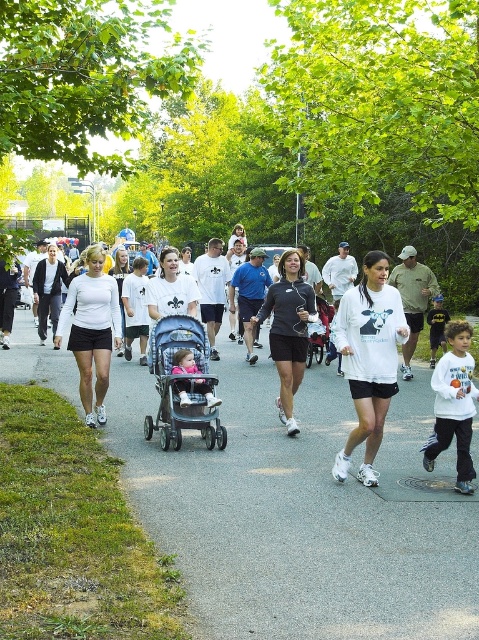
Question: Is white matte long-sleeve shirt at center bigger than matte pink stroller at center?

Choices:
 (A) no
 (B) yes

Answer: (B)

Question: Which point is farther to the camera?

Choices:
 (A) (203, 378)
 (B) (89, 321)
 (C) (298, 401)

Answer: (C)

Question: Does gray asphalt pavement at center come in front of blue fabric stroller at center?

Choices:
 (A) yes
 (B) no

Answer: (A)

Question: Which point appears farthest from the camera in this image?

Choices:
 (A) (150, 525)
 (B) (367, 310)
 (C) (171, 333)

Answer: (C)

Question: Which point is farther to the camera?

Choices:
 (A) white matte t-shirt at center
 (B) matte black running outfit at center

Answer: (A)

Question: From the image, what is the correct spatial relationship of gray asphalt pavement at center in relation to white matte shorts at center?

Choices:
 (A) left
 (B) right

Answer: (B)